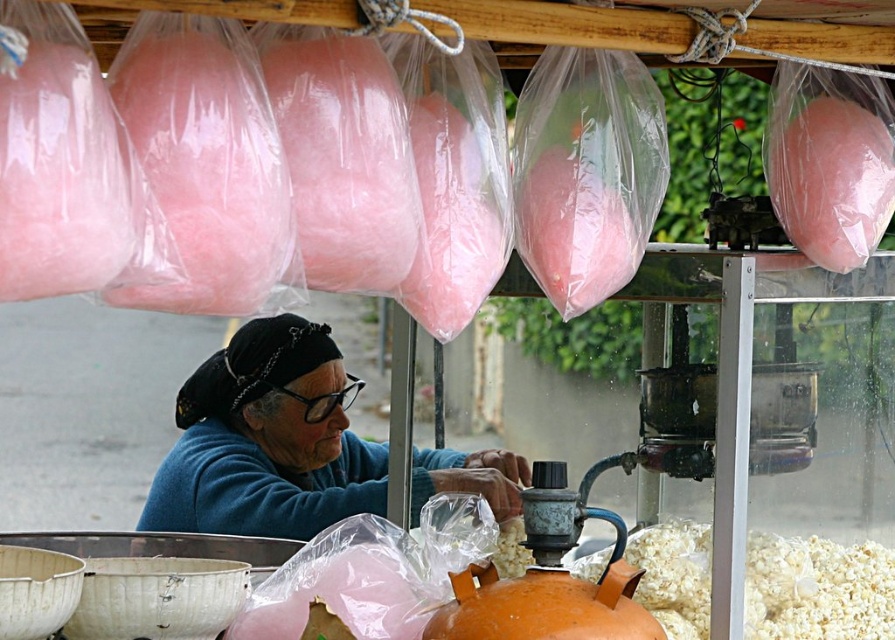
Who is lower down, blue fabric at center or white fluffy popcorn at lower right?

blue fabric at center is lower down.

Can you confirm if blue fabric at center is smaller than white fluffy popcorn at lower right?

No, blue fabric at center is not smaller than white fluffy popcorn at lower right.

Describe the element at coordinates (267, 440) in the screenshot. I see `blue fabric at center` at that location.

Find the location of `blue fabric at center`. blue fabric at center is located at coordinates (267, 440).

Find the location of a particular element. Image resolution: width=895 pixels, height=640 pixels. blue fabric at center is located at coordinates (267, 440).

Which is below, blue fabric at center or pink cotton candy at upper right?

blue fabric at center is lower down.

Locate an element on the screen. blue fabric at center is located at coordinates (267, 440).

Does white fluffy popcorn at lower right have a smaller size compared to pink cotton candy at upper right?

No.

What are the coordinates of `white fluffy popcorn at lower right` in the screenshot? It's located at (817, 589).